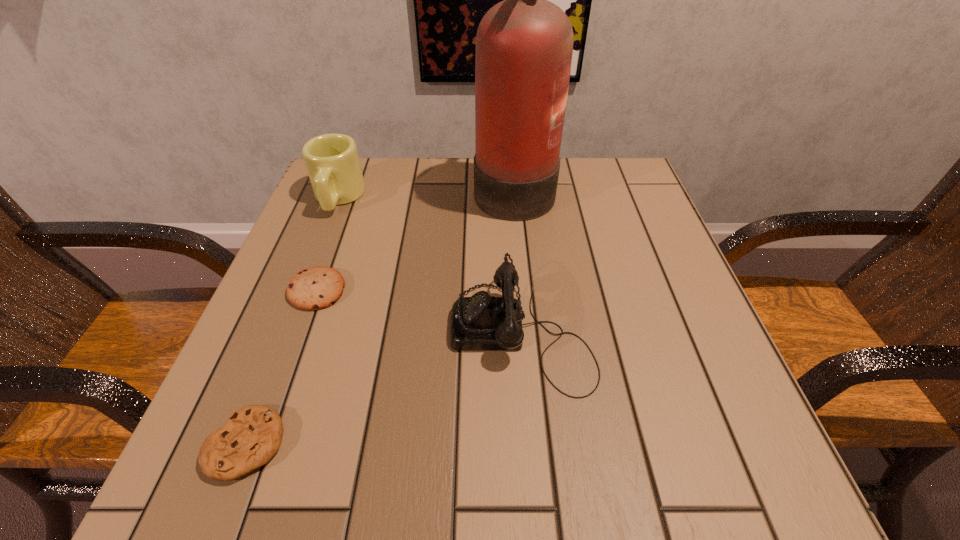
Locate an element on the screen. The width and height of the screenshot is (960, 540). unoccupied position between the tallest object and the mug is located at coordinates (426, 192).

I want to click on unoccupied position between the farther cookie and the mug, so click(x=327, y=244).

Identify the location of unoccupied area between the farther cookie and the third shortest object. Image resolution: width=960 pixels, height=540 pixels. (419, 310).

You are a GUI agent. You are given a task and a screenshot of the screen. Output one action in this format:
    pyautogui.click(x=<x>, y=<y>)
    Task: Click on the object that stands as the closest to the farther cookie
    The width and height of the screenshot is (960, 540).
    Given the screenshot: What is the action you would take?
    pyautogui.click(x=332, y=161)

Find the location of a particular element. The height and width of the screenshot is (540, 960). object that is the third closest one to the mug is located at coordinates (481, 322).

This screenshot has height=540, width=960. Find the location of `free location that satisfies the following two spatial constraints: 1. at the nozzle of the fire extinguisher; 2. with the handle on the side of the second tallest object`. free location that satisfies the following two spatial constraints: 1. at the nozzle of the fire extinguisher; 2. with the handle on the side of the second tallest object is located at coordinates (515, 198).

Find the location of a particular element. This screenshot has width=960, height=540. vacant space that satisfies the following two spatial constraints: 1. at the nozzle of the tallest object; 2. with the handle on the side of the fourth shortest object is located at coordinates (515, 198).

I want to click on free space that satisfies the following two spatial constraints: 1. with the handle on the side of the nearest object; 2. on the right side of the mug, so click(x=241, y=444).

Where is `free space that satisfies the following two spatial constraints: 1. with the handle on the side of the farther cookie; 2. on the right side of the mug`? The height and width of the screenshot is (540, 960). free space that satisfies the following two spatial constraints: 1. with the handle on the side of the farther cookie; 2. on the right side of the mug is located at coordinates (301, 291).

Where is `free spot that satisfies the following two spatial constraints: 1. with the handle on the side of the fourth shortest object; 2. on the right side of the farther cookie`? free spot that satisfies the following two spatial constraints: 1. with the handle on the side of the fourth shortest object; 2. on the right side of the farther cookie is located at coordinates click(x=301, y=291).